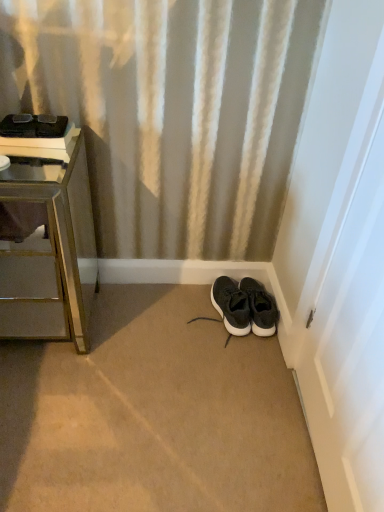
Identify the location of vacant area that lies between brushed metal nightstand at left and black fabric sneakers at center, acting as the 2th footwear starting from the right. (150, 319).